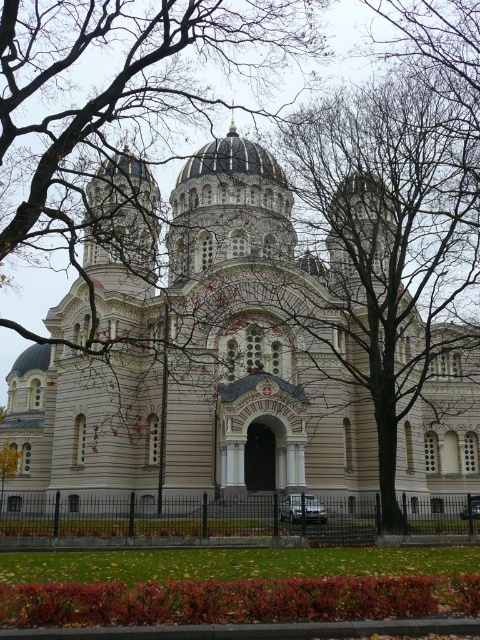
Is light beige stone church at center smaller than gold domed roof at center?

Actually, light beige stone church at center might be larger than gold domed roof at center.

Between point (159, 403) and point (200, 148), which one is positioned behind?

The point (200, 148) is more distant.

Who is more forward, (60,401) or (229,145)?

Point (60,401)

At what (x,y) coordinates should I click in order to perform the action: click on light beige stone church at center. Please return your answer as a coordinate pair (x, y). This screenshot has width=480, height=640. Looking at the image, I should click on (200, 365).

Can you confirm if bare branches at center is positioned below gold domed roof at center?

Yes, bare branches at center is below gold domed roof at center.

Between bare branches at center and gold domed roof at center, which one has less height?

gold domed roof at center is shorter.

Measure the distance between bare branches at center and camera.

The distance of bare branches at center from camera is 163.61 feet.

The width and height of the screenshot is (480, 640). In order to click on bare branches at center in this screenshot , I will do `click(120, 90)`.

Does light beige stone church at center have a greater width compared to bare branches at center?

Indeed, light beige stone church at center has a greater width compared to bare branches at center.

Does light beige stone church at center appear on the right side of bare branches at center?

Yes, light beige stone church at center is to the right of bare branches at center.

Which is behind, point (49, 419) or point (271, 70)?

Positioned behind is point (271, 70).

Where is `light beige stone church at center`? light beige stone church at center is located at coordinates (200, 365).